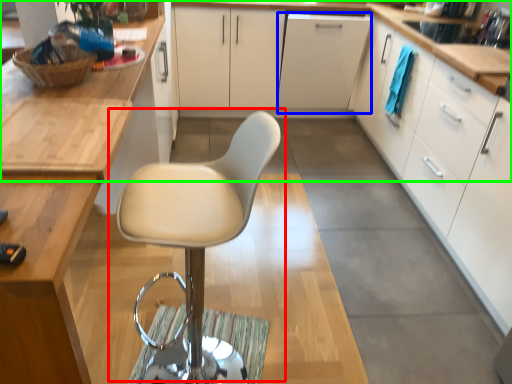
Question: Which is farther away from chair (highlighted by a red box)? file cabinet (highlighted by a blue box) or countertop (highlighted by a green box)?

Choices:
 (A) file cabinet
 (B) countertop

Answer: (A)